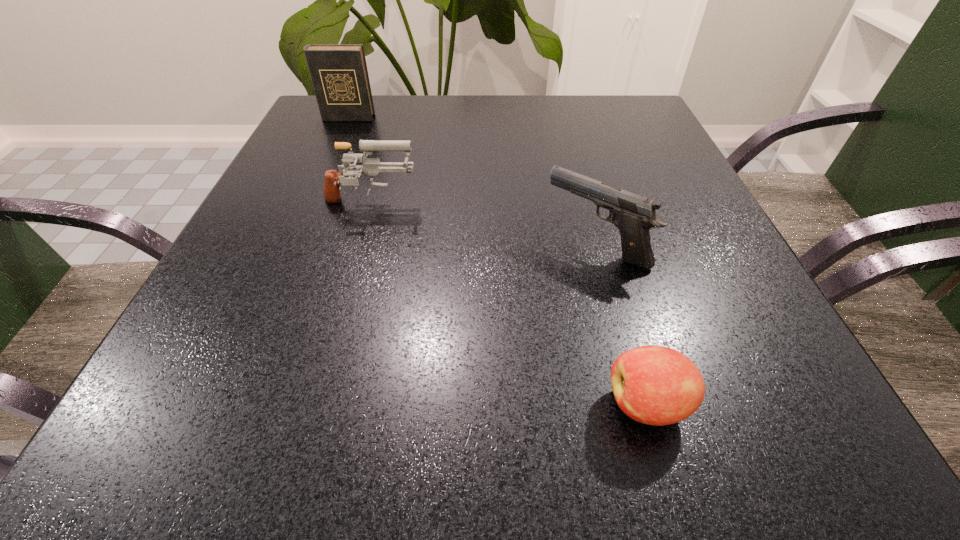
The image size is (960, 540). I want to click on vacant space at the right edge of the desktop, so click(x=676, y=161).

The width and height of the screenshot is (960, 540). In the image, there is a desktop. In order to click on vacant space at the far left corner in this screenshot , I will do `click(319, 127)`.

Locate an element on the screen. Image resolution: width=960 pixels, height=540 pixels. free spot at the far right corner of the desktop is located at coordinates (635, 110).

In the image, there is a desktop. Where is `vacant region at the near right corner`? This screenshot has width=960, height=540. vacant region at the near right corner is located at coordinates (855, 465).

Where is `vacant point located between the right gun and the nearest object`? The width and height of the screenshot is (960, 540). vacant point located between the right gun and the nearest object is located at coordinates point(621,325).

This screenshot has height=540, width=960. Identify the location of free space between the apple and the diary. (497, 261).

Locate an element on the screen. The width and height of the screenshot is (960, 540). vacant area that lies between the left gun and the right gun is located at coordinates (483, 225).

Identify the location of vacant area between the right gun and the left gun. This screenshot has width=960, height=540. (483, 225).

Locate an element on the screen. Image resolution: width=960 pixels, height=540 pixels. vacant space that's between the farthest object and the shortest object is located at coordinates (497, 261).

Where is `vacant region between the left gun and the right gun`? The image size is (960, 540). vacant region between the left gun and the right gun is located at coordinates coord(483,225).